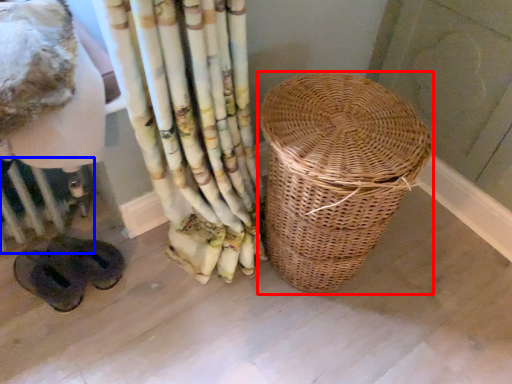
Question: Among these objects, which one is farthest to the camera, picnic basket (highlighted by a red box) or radiator (highlighted by a blue box)?

Choices:
 (A) picnic basket
 (B) radiator

Answer: (B)